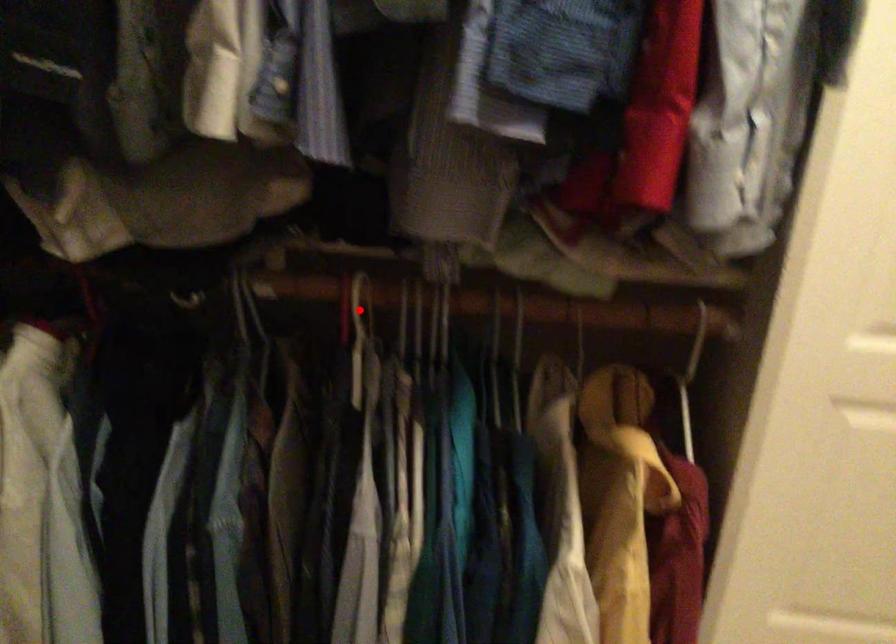
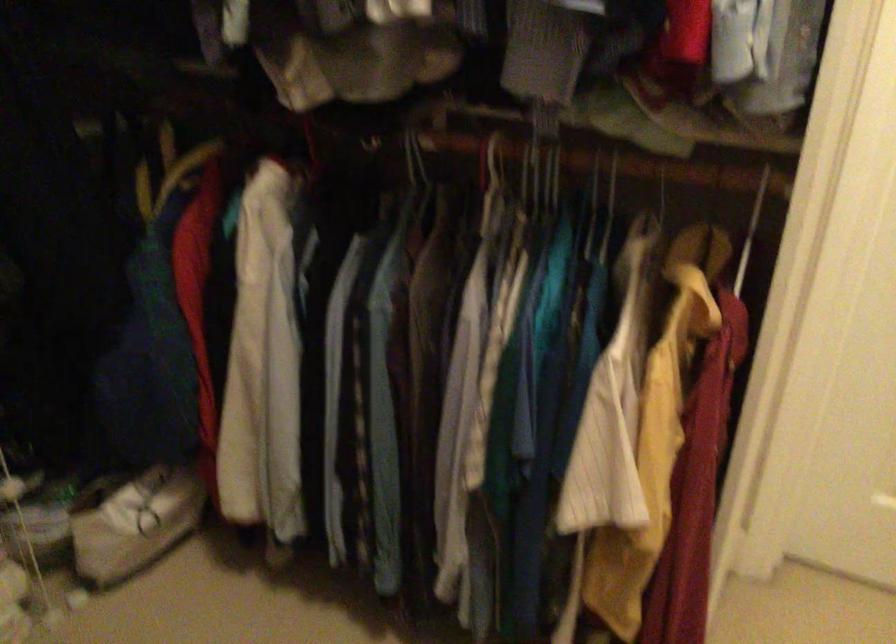
Where in the second image is the point corresponding to the highlighted location from the first image?

(494, 161)